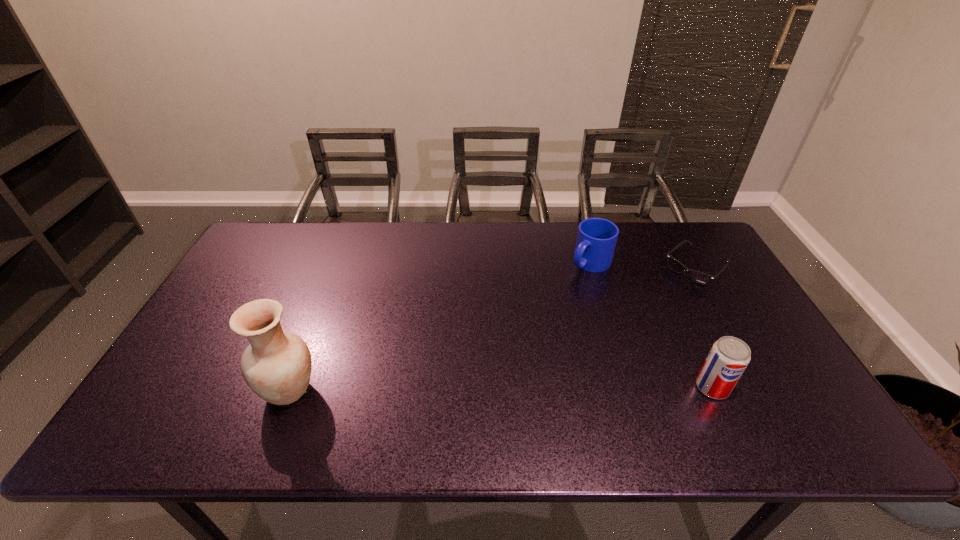
Locate an element on the screen. Image resolution: width=960 pixels, height=540 pixels. vacant space at the far edge of the desktop is located at coordinates (475, 228).

Find the location of a particular element. This screenshot has height=540, width=960. vacant space at the near edge of the desktop is located at coordinates (697, 398).

The width and height of the screenshot is (960, 540). In the image, there is a desktop. Find the location of `vacant space at the left edge`. vacant space at the left edge is located at coordinates (250, 288).

In the image, there is a desktop. Where is `vacant space at the right edge`? Image resolution: width=960 pixels, height=540 pixels. vacant space at the right edge is located at coordinates (725, 270).

Where is `vacant region at the far left corner`? Image resolution: width=960 pixels, height=540 pixels. vacant region at the far left corner is located at coordinates (252, 244).

Where is `blank area at the near left corner`? This screenshot has height=540, width=960. blank area at the near left corner is located at coordinates (188, 402).

Identify the location of vacant area at the near right corner of the desktop. The height and width of the screenshot is (540, 960). (762, 381).

Identify the location of empty space that is in between the soda and the shortest object. (704, 328).

At what (x,y) coordinates should I click in order to perform the action: click on empty location between the shortest object and the second object from left to right. Please return your answer as a coordinate pair (x, y). This screenshot has width=960, height=540. Looking at the image, I should click on (643, 266).

Where is `free space between the pottery and the soda`? free space between the pottery and the soda is located at coordinates (501, 389).